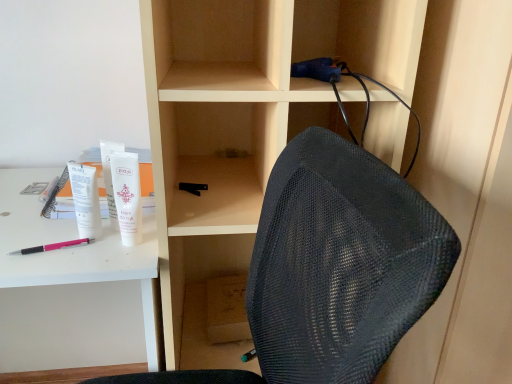
Question: Would you consider matte wood cabinet at center to be distant from pink plastic pen at lower left?

Choices:
 (A) no
 (B) yes

Answer: (A)

Question: Considering the relative positions of matte wood cabinet at center and pink plastic pen at lower left in the image provided, is matte wood cabinet at center to the left of pink plastic pen at lower left from the viewer's perspective?

Choices:
 (A) no
 (B) yes

Answer: (A)

Question: Considering the relative sizes of matte wood cabinet at center and pink plastic pen at lower left in the image provided, is matte wood cabinet at center thinner than pink plastic pen at lower left?

Choices:
 (A) no
 (B) yes

Answer: (A)

Question: Is matte wood cabinet at center taller than pink plastic pen at lower left?

Choices:
 (A) no
 (B) yes

Answer: (B)

Question: Considering the relative sizes of matte wood cabinet at center and pink plastic pen at lower left in the image provided, is matte wood cabinet at center wider than pink plastic pen at lower left?

Choices:
 (A) yes
 (B) no

Answer: (A)

Question: Is matte wood cabinet at center shorter than pink plastic pen at lower left?

Choices:
 (A) yes
 (B) no

Answer: (B)

Question: From the image's perspective, is white matte tube at upper left, which is the second stationery in left-to-right order, on top of white plastic desk at upper left?

Choices:
 (A) yes
 (B) no

Answer: (A)

Question: Does white matte tube at upper left, the second stationery positioned from the top, have a lesser width compared to white plastic desk at upper left?

Choices:
 (A) yes
 (B) no

Answer: (A)

Question: Can you confirm if white matte tube at upper left, the second stationery positioned from the top, is positioned to the left of white plastic desk at upper left?

Choices:
 (A) yes
 (B) no

Answer: (B)

Question: From a real-world perspective, does white matte tube at upper left, which is the 3th stationery in right-to-left order, sit lower than white plastic desk at upper left?

Choices:
 (A) yes
 (B) no

Answer: (B)

Question: Is white matte tube at upper left, which is the second stationery in left-to-right order, with white plastic desk at upper left?

Choices:
 (A) no
 (B) yes

Answer: (A)

Question: Would you say white plastic desk at upper left is part of white matte tube at upper left, which is the 3th stationery in right-to-left order,'s contents?

Choices:
 (A) no
 (B) yes

Answer: (A)

Question: Considering the relative sizes of white matte tube at upper left and white matte tube at upper left, the 3th stationery positioned from the bottom, in the image provided, is white matte tube at upper left smaller than white matte tube at upper left, the 3th stationery positioned from the bottom,?

Choices:
 (A) yes
 (B) no

Answer: (B)